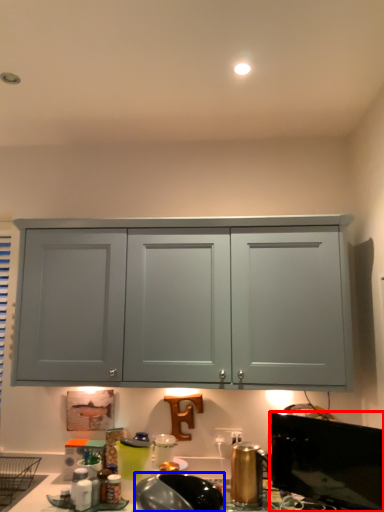
Question: Among these objects, which one is farthest to the camera, window screen (highlighted by a red box) or appliance (highlighted by a blue box)?

Choices:
 (A) window screen
 (B) appliance

Answer: (A)